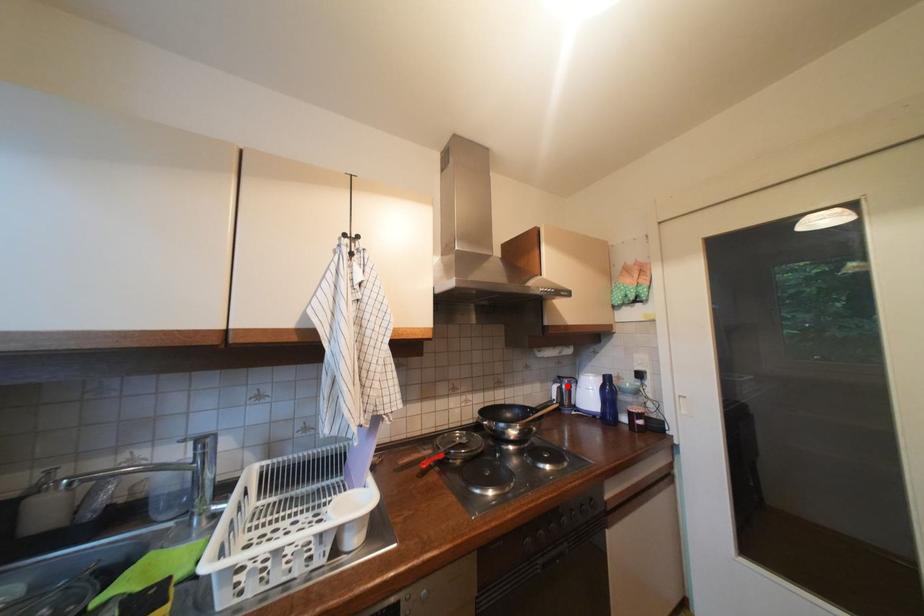
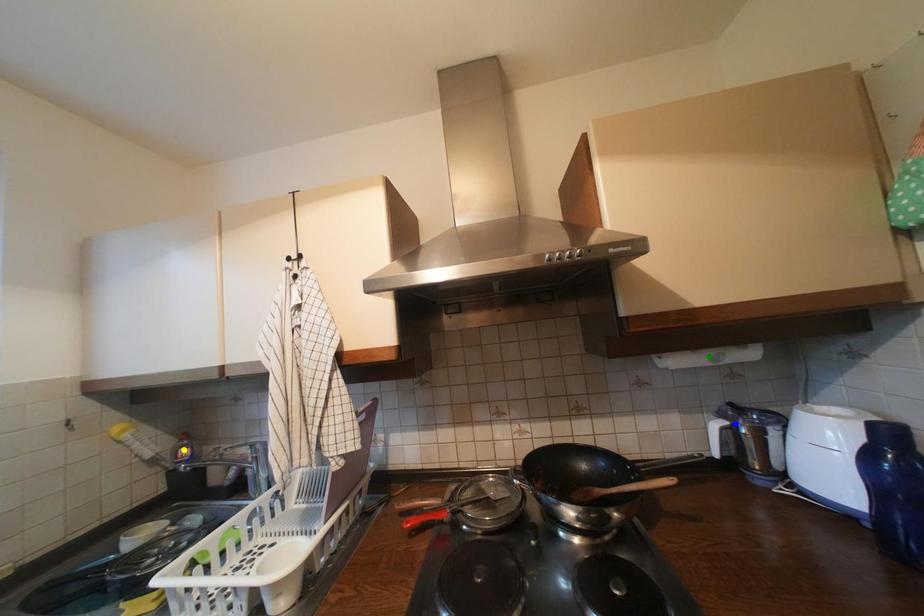
Question: I am providing you with two images of the same scene from different viewpoints. A red point is marked on the first image. You are given multiple points on the second image. Which spot in image 2 lines up with the point in image 1?

Choices:
 (A) blue point
 (B) yellow point
 (C) green point

Answer: (A)